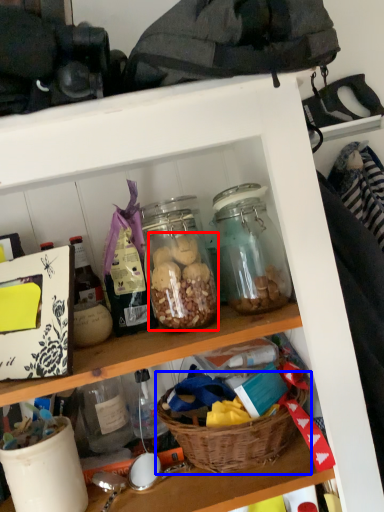
Question: Which point is further to the camera, food (highlighted by a red box) or basket (highlighted by a blue box)?

Choices:
 (A) food
 (B) basket

Answer: (A)